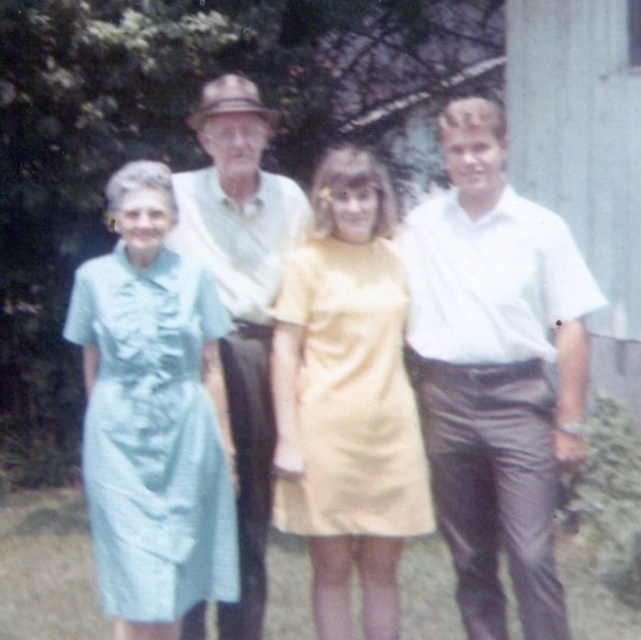
Question: Estimate the real-world distances between objects in this image. Which object is closer to the yellow matte dress at center?

Choices:
 (A) light green fabric shirt at center
 (B) white smooth shirt at right
 (C) light blue fabric dress at left

Answer: (B)

Question: Is yellow matte dress at center below light green fabric shirt at center?

Choices:
 (A) yes
 (B) no

Answer: (A)

Question: Which object is positioned farthest from the white smooth shirt at right?

Choices:
 (A) yellow matte dress at center
 (B) light blue fabric dress at left

Answer: (B)

Question: Which object is farther from the camera taking this photo?

Choices:
 (A) yellow matte dress at center
 (B) light green fabric shirt at center
 (C) white smooth shirt at right
 (D) light blue fabric dress at left

Answer: (B)

Question: Does white smooth shirt at right lie behind light green fabric shirt at center?

Choices:
 (A) no
 (B) yes

Answer: (A)

Question: Does white smooth shirt at right have a larger size compared to light blue fabric dress at left?

Choices:
 (A) no
 (B) yes

Answer: (B)